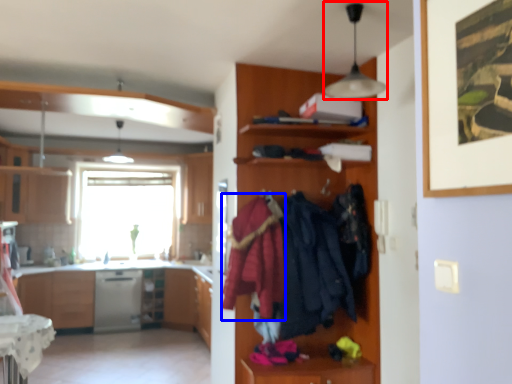
Question: Which of the following is the closest to the observer, light fixture (highlighted by a red box) or clothing (highlighted by a blue box)?

Choices:
 (A) light fixture
 (B) clothing

Answer: (A)